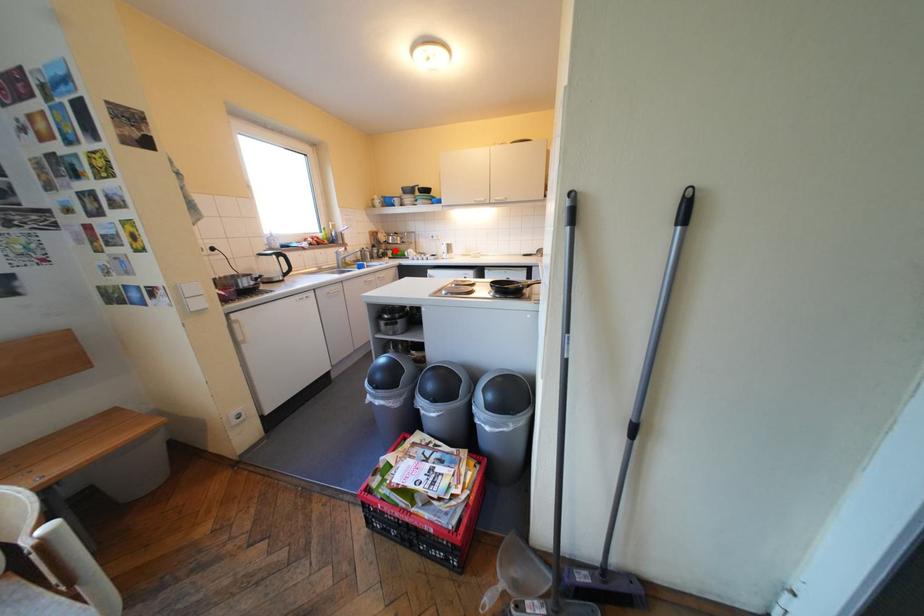
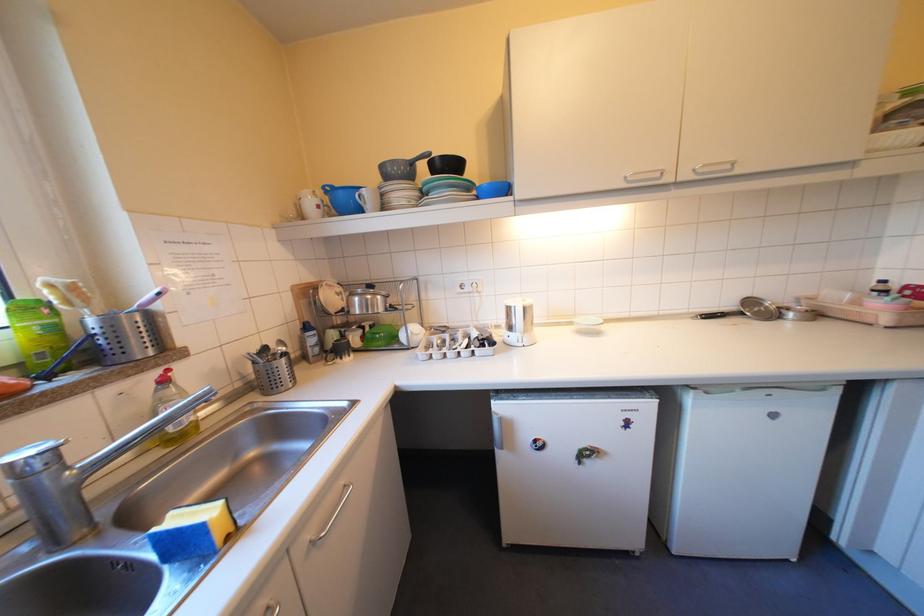
Where in the second image is the point corresponding to the highlighted location from the first image?

(346, 334)